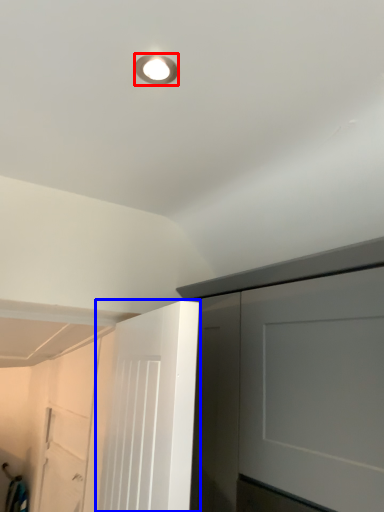
Question: Which object is further to the camera taking this photo, droplight (highlighted by a red box) or door (highlighted by a blue box)?

Choices:
 (A) droplight
 (B) door

Answer: (A)